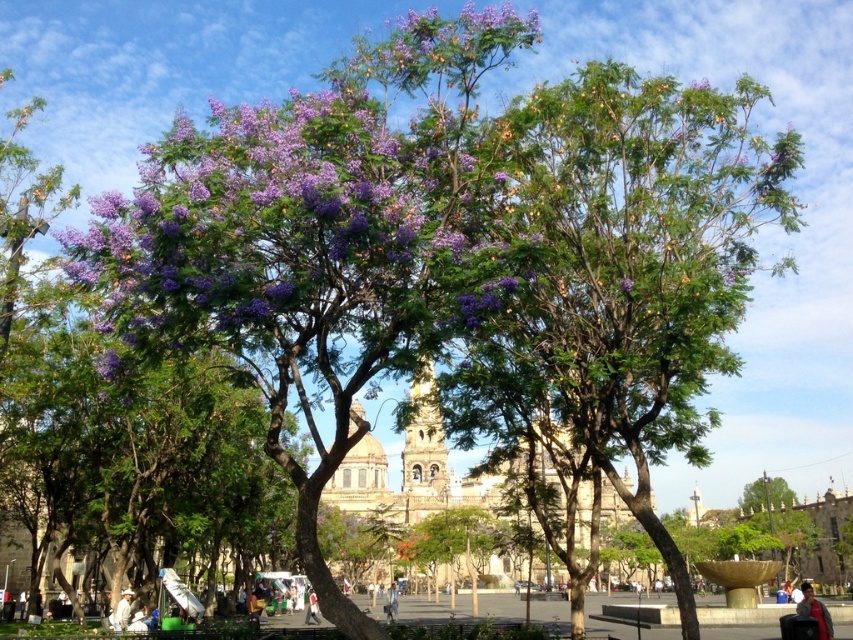
Is purple leafy tree at center to the right of purple matte flower at upper center from the viewer's perspective?

Incorrect, purple leafy tree at center is not on the right side of purple matte flower at upper center.

From the picture: Can you confirm if purple leafy tree at center is taller than purple matte flower at upper center?

Yes, purple leafy tree at center is taller than purple matte flower at upper center.

Find the location of a particular element. purple leafy tree at center is located at coordinates (624, 272).

Which of these two, white fabric at center or white cotton shirt at center, stands shorter?

white cotton shirt at center is shorter.

Between point (131, 593) and point (312, 598), which one is positioned behind?

The point (312, 598) is more distant.

Does point (119, 625) lie behind point (306, 616)?

No, (119, 625) is in front of (306, 616).

Identify the location of white fabric at center. point(122,611).

Is light blue denim jacket at center bigger than purple matte flower at upper center?

Correct, light blue denim jacket at center is larger in size than purple matte flower at upper center.

Which is in front, point (386, 611) or point (619, 284)?

Point (619, 284)

Is point (392, 602) positioned after point (625, 280)?

Yes, point (392, 602) is behind point (625, 280).

You are a GUI agent. You are given a task and a screenshot of the screen. Output one action in this format:
    pyautogui.click(x=<x>, y=<y>)
    Task: Click on the light blue denim jacket at center
    The height and width of the screenshot is (640, 853).
    Given the screenshot: What is the action you would take?
    pyautogui.click(x=392, y=604)